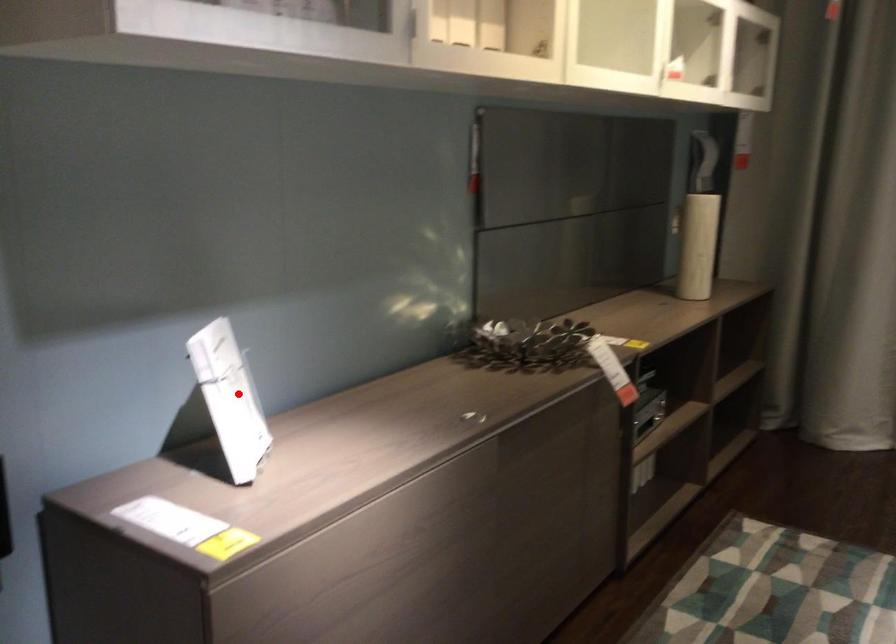
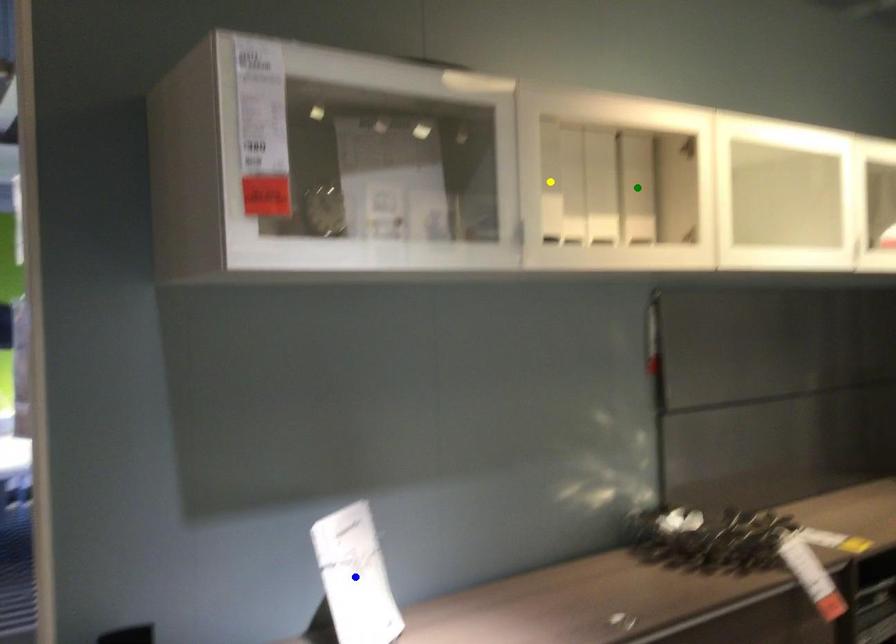
Question: I am providing you with two images of the same scene from different viewpoints. A red point is marked on the first image. You are given multiple points on the second image. Can you choose the point in image 2 that corresponds to the point in image 1?

Choices:
 (A) blue point
 (B) green point
 (C) yellow point

Answer: (A)